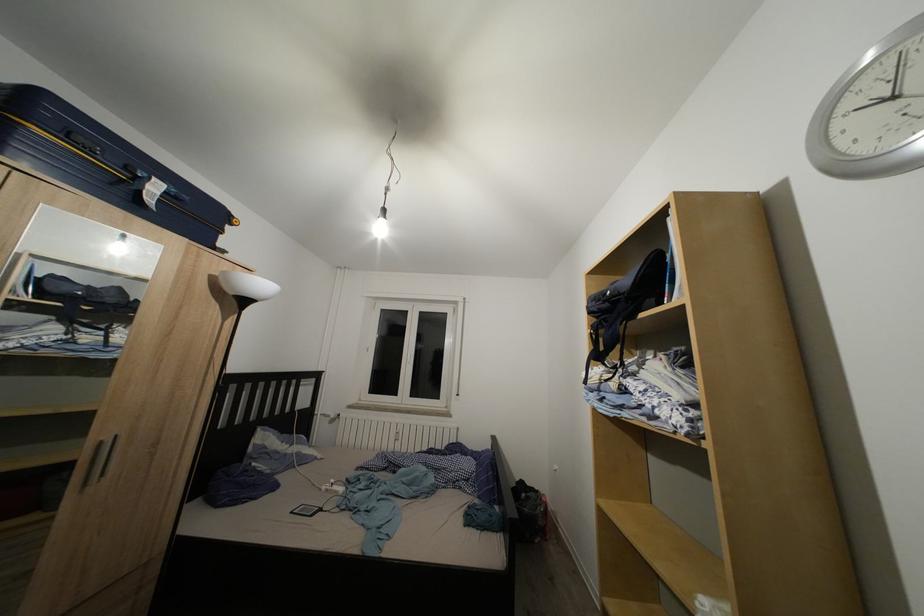
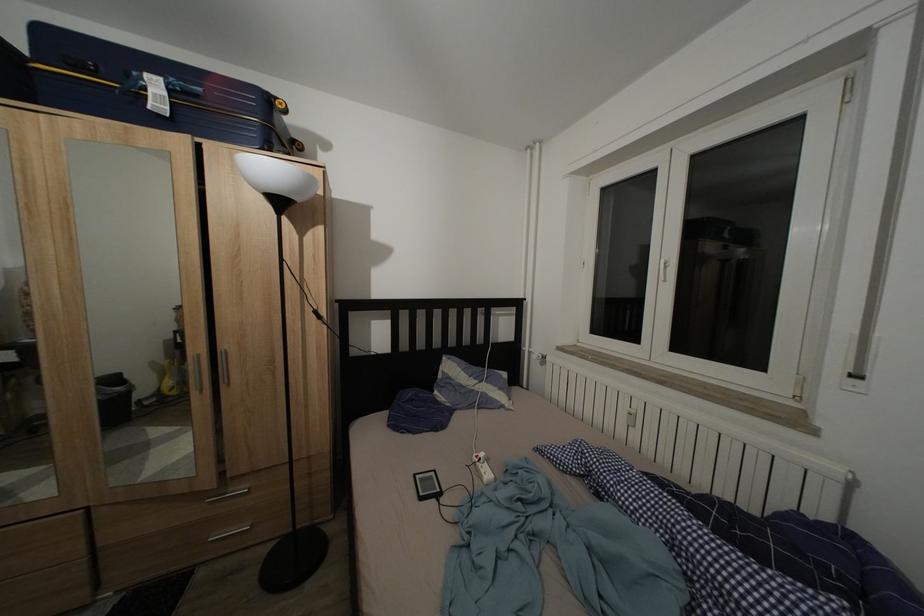
In the second image, find the point that corresponds to (344,499) in the first image.

(488, 483)